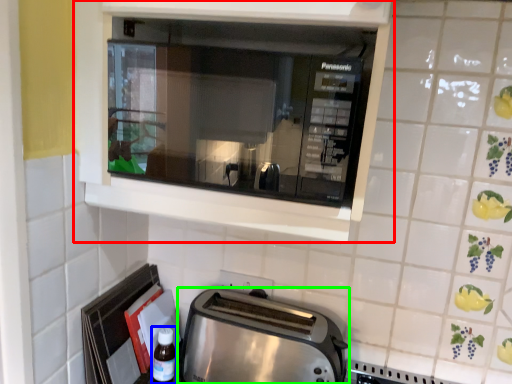
Question: Which is nearer to the cabinetry (highlighted by a red box)? bottle (highlighted by a blue box) or toaster (highlighted by a green box).

Choices:
 (A) bottle
 (B) toaster

Answer: (B)